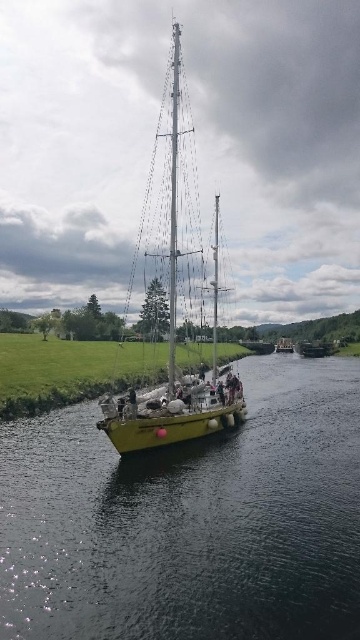
Who is positioned more to the right, yellow matte sailboat at center or metallic silver mast at center?

metallic silver mast at center

Can you confirm if yellow matte sailboat at center is taller than metallic silver mast at center?

Indeed, yellow matte sailboat at center has a greater height compared to metallic silver mast at center.

The image size is (360, 640). What do you see at coordinates (176, 288) in the screenshot?
I see `yellow matte sailboat at center` at bounding box center [176, 288].

Identify the location of yellow matte sailboat at center. click(176, 288).

Is smooth yellow boat at center positioned at the back of yellow matte sailboat at center?

That is False.

Which is in front, point (47, 557) or point (191, 241)?

Positioned in front is point (47, 557).

Is point (163, 481) more distant than point (186, 360)?

No, (163, 481) is closer to viewer.

Where is `smooth yellow boat at center`? smooth yellow boat at center is located at coordinates (190, 520).

Can you confirm if smooth yellow boat at center is positioned above metallic silver mast at center?

No.

Is smooth yellow boat at center thinner than metallic silver mast at center?

No, smooth yellow boat at center is not thinner than metallic silver mast at center.

Who is more distant from viewer, (258, 452) or (174, 368)?

The point (174, 368) is behind.

Where is `smooth yellow boat at center`? The height and width of the screenshot is (640, 360). smooth yellow boat at center is located at coordinates (190, 520).